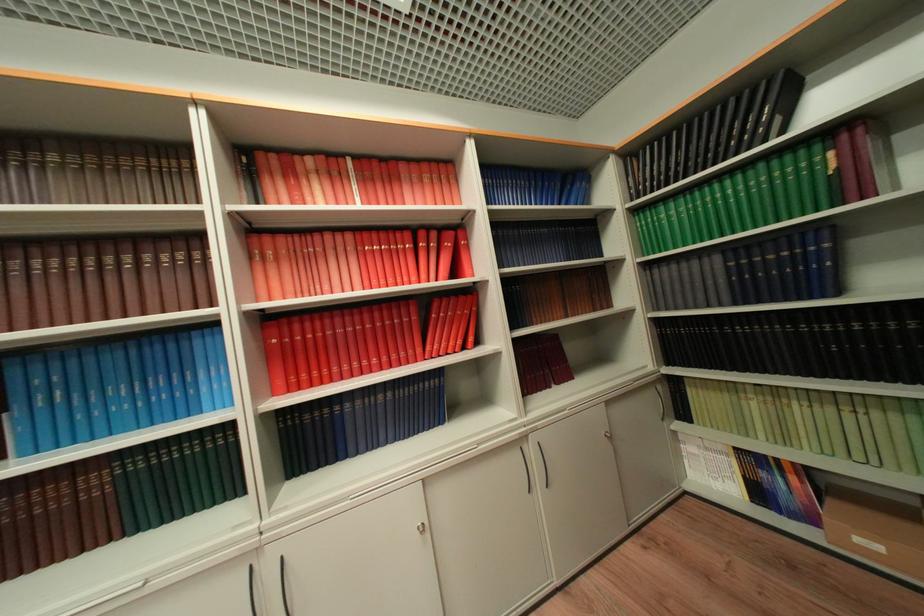
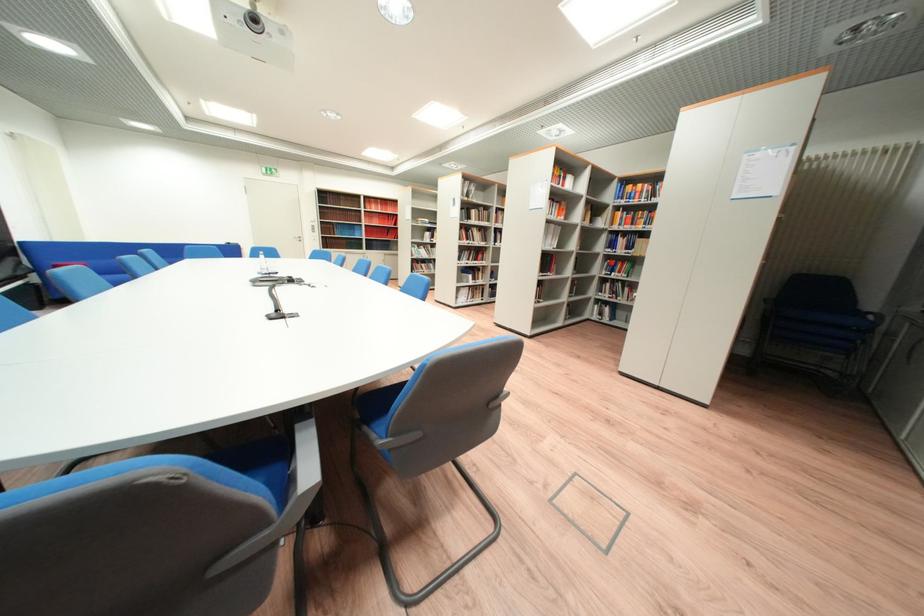
Question: I am providing you with two images of the same scene from different viewpoints. Which of the following objects are not visible in image2?

Choices:
 (A) blue chair sitting surface
 (B) small metal bowl
 (C) green book
 (D) clear water bottle

Answer: (C)